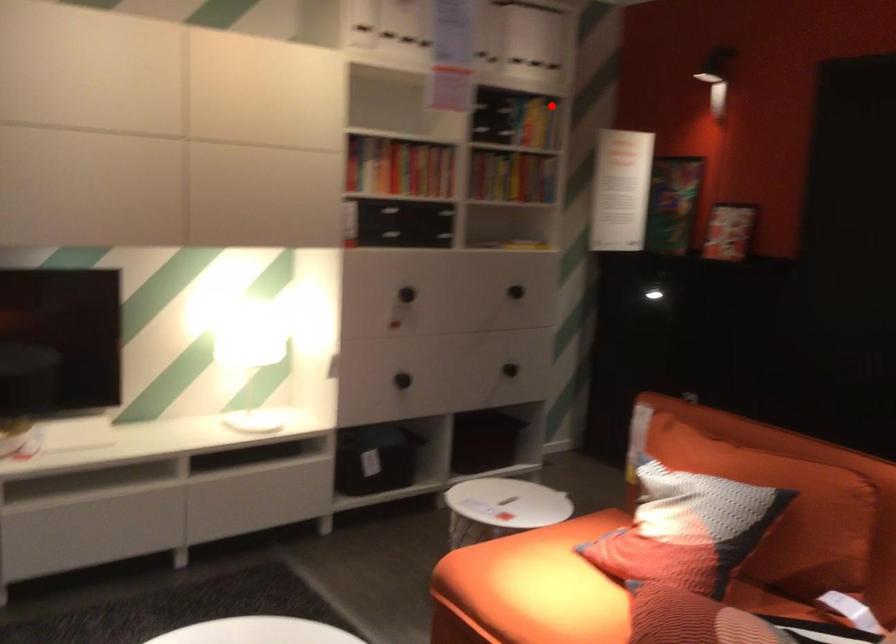
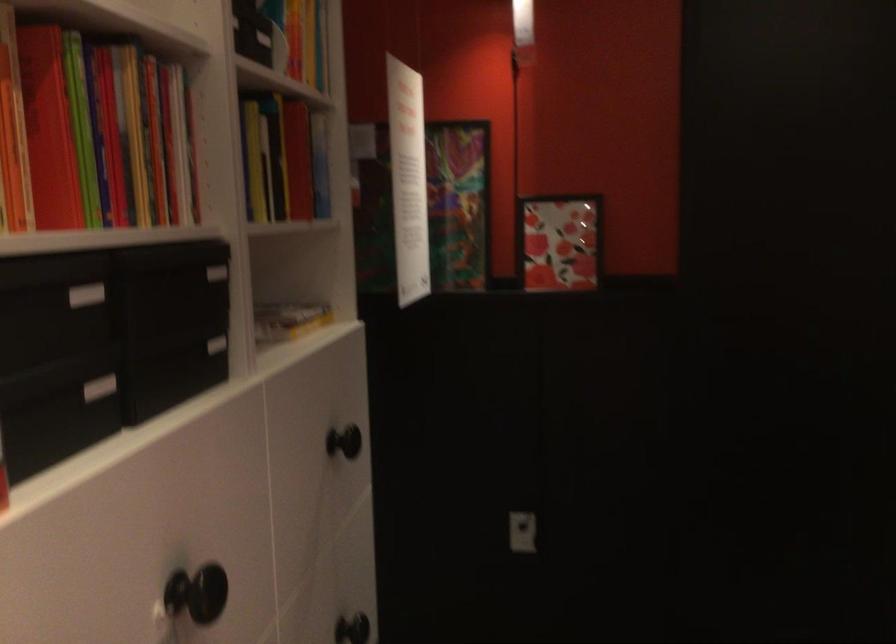
Question: I am providing you with two images of the same scene from different viewpoints. A red point is shown in image1. For the corresponding object point in image2, is it positioned nearer or farther from the camera?

Choices:
 (A) Nearer
 (B) Farther

Answer: (A)